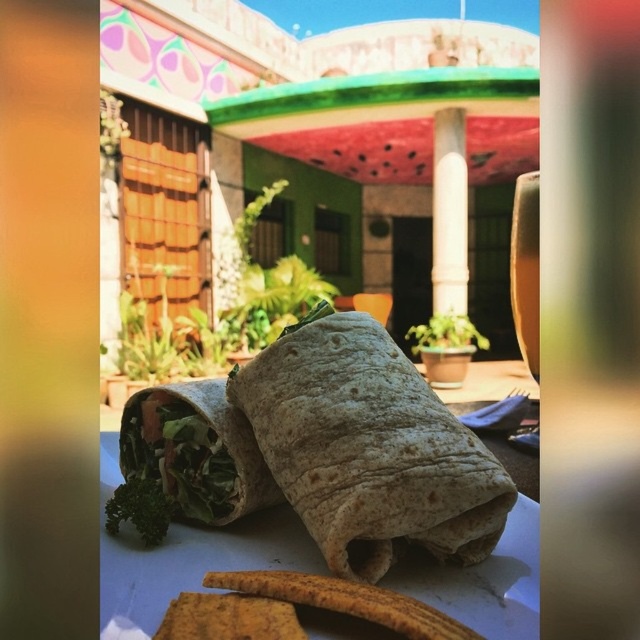
Question: Which is farther from the white paper plate at center?

Choices:
 (A) brown tortilla burrito at center
 (B) green leafy burrito at center

Answer: (B)

Question: Is brown tortilla burrito at center to the right of white smooth pillar at center from the viewer's perspective?

Choices:
 (A) yes
 (B) no

Answer: (B)

Question: Does green leafy burrito at center have a smaller size compared to white smooth pillar at center?

Choices:
 (A) no
 (B) yes

Answer: (B)

Question: Which of these objects is positioned farthest from the brown tortilla burrito at center?

Choices:
 (A) white smooth pillar at center
 (B) green leafy burrito at center
 (C) white paper plate at center

Answer: (A)

Question: Does white paper plate at center appear on the left side of green leafy burrito at center?

Choices:
 (A) no
 (B) yes

Answer: (A)

Question: Which object appears closest to the camera in this image?

Choices:
 (A) brown tortilla burrito at center
 (B) white smooth pillar at center
 (C) white paper plate at center
 (D) green leafy burrito at center

Answer: (C)